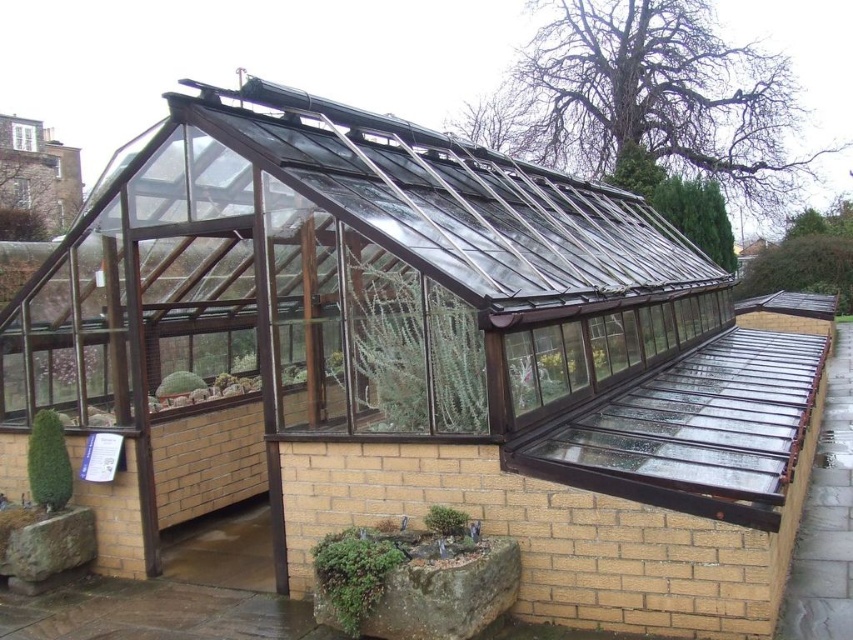
Is green matte coniferous tree at lower left bigger than green matte plant at center?

Correct, green matte coniferous tree at lower left is larger in size than green matte plant at center.

Which is above, green matte coniferous tree at lower left or green matte plant at center?

green matte plant at center

You are a GUI agent. You are given a task and a screenshot of the screen. Output one action in this format:
    pyautogui.click(x=<x>, y=<y>)
    Task: Click on the green matte coniferous tree at lower left
    
    Given the screenshot: What is the action you would take?
    pyautogui.click(x=48, y=461)

Who is shorter, green mossy rock at lower center or green matte coniferous tree at lower left?

With less height is green mossy rock at lower center.

Between point (366, 545) and point (59, 483), which one is positioned in front?

Point (366, 545) is more forward.

Identify the location of green mossy rock at lower center. The image size is (853, 640). (352, 573).

Which is in front, point (482, 374) or point (227, 378)?

Point (482, 374)

Is the position of green matte glass plant at center more distant than that of green matte cactus at center?

No, it is not.

Is point (432, 317) in front of point (216, 385)?

Yes, it is.

Identify the location of green matte glass plant at center. Image resolution: width=853 pixels, height=640 pixels. (408, 348).